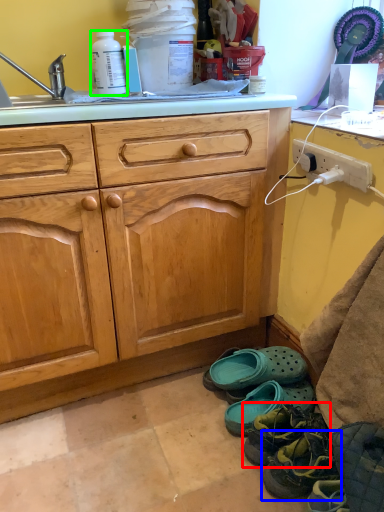
Question: Based on their relative distances, which object is farther from footwear (highlighted by a red box)? Choose from footwear (highlighted by a blue box) and bottle (highlighted by a green box).

Choices:
 (A) footwear
 (B) bottle

Answer: (B)